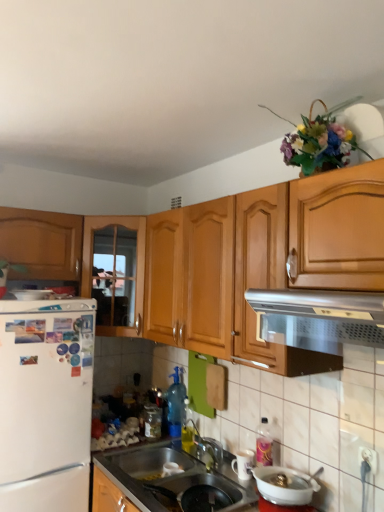
Question: Is white glossy bowl at lower center, the second appliance when ordered from top to bottom, taller or shorter than wooden cabinet at left, placed as the second cabinetry when sorted from left to right?

Choices:
 (A) tall
 (B) short

Answer: (B)

Question: From a real-world perspective, is white glossy bowl at lower center, the second appliance when ordered from top to bottom, positioned above or below wooden cabinet at left, placed as the second cabinetry when sorted from left to right?

Choices:
 (A) above
 (B) below

Answer: (B)

Question: Which of these objects is positioned closest to the silver metallic vent at upper center?

Choices:
 (A) white glossy bowl at lower center, acting as the 2th appliance starting from the bottom
 (B) transparent glass jar at sink, which is the second bottle in right-to-left order
 (C) wooden cabinet at left, which ranks as the first cabinetry in left-to-right order
 (D) metallic stainless steel sink at lower center
 (E) white glossy mug at lower center, which is the second appliance from front to back

Answer: (A)

Question: Which of these objects is positioned closest to the white glossy refrigerator at left, which is counted as the first appliance, starting from the back?

Choices:
 (A) white glossy mug at lower center, the third appliance when ordered from top to bottom
 (B) metallic stainless steel sink at lower center
 (C) white glossy bowl at lower center, acting as the 2th appliance starting from the bottom
 (D) transparent glass jar at sink, which is the second bottle in right-to-left order
 (E) white matte refrigerator at left

Answer: (E)